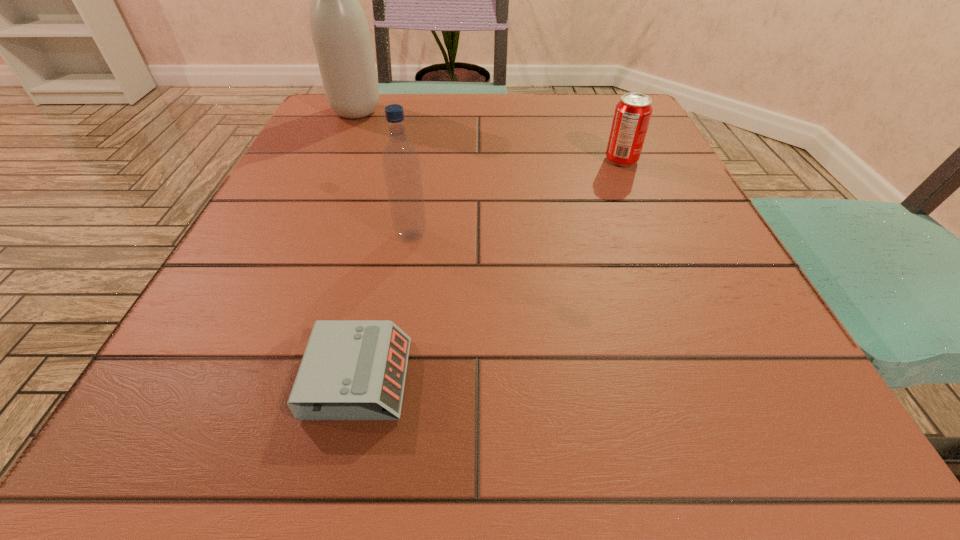
Where is `the leftmost object`? the leftmost object is located at coordinates (340, 33).

You are a GUI agent. You are given a task and a screenshot of the screen. Output one action in this format:
    pyautogui.click(x=<x>, y=<y>)
    Task: Click on the farthest object
    
    Given the screenshot: What is the action you would take?
    click(x=340, y=33)

At what (x,y) coordinates should I click in order to perform the action: click on the third farthest object. Please return your answer as a coordinate pair (x, y). The width and height of the screenshot is (960, 540). Looking at the image, I should click on (401, 162).

This screenshot has width=960, height=540. What are the coordinates of `water bottle` in the screenshot? It's located at (401, 162).

You are a GUI agent. You are given a task and a screenshot of the screen. Output one action in this format:
    pyautogui.click(x=<x>, y=<y>)
    Task: Click on the soda
    The height and width of the screenshot is (540, 960).
    Given the screenshot: What is the action you would take?
    pyautogui.click(x=633, y=112)

Where is `the rightmost object`? The height and width of the screenshot is (540, 960). the rightmost object is located at coordinates (633, 112).

Locate an element on the screen. This screenshot has height=540, width=960. the nearest object is located at coordinates (351, 369).

This screenshot has height=540, width=960. I want to click on alarm clock, so click(x=351, y=369).

This screenshot has width=960, height=540. What are the coordinates of `vacant space located on the front of the farthest object` in the screenshot? It's located at (304, 228).

Image resolution: width=960 pixels, height=540 pixels. I want to click on free space located 0.200m on the back of the water bottle, so click(x=424, y=162).